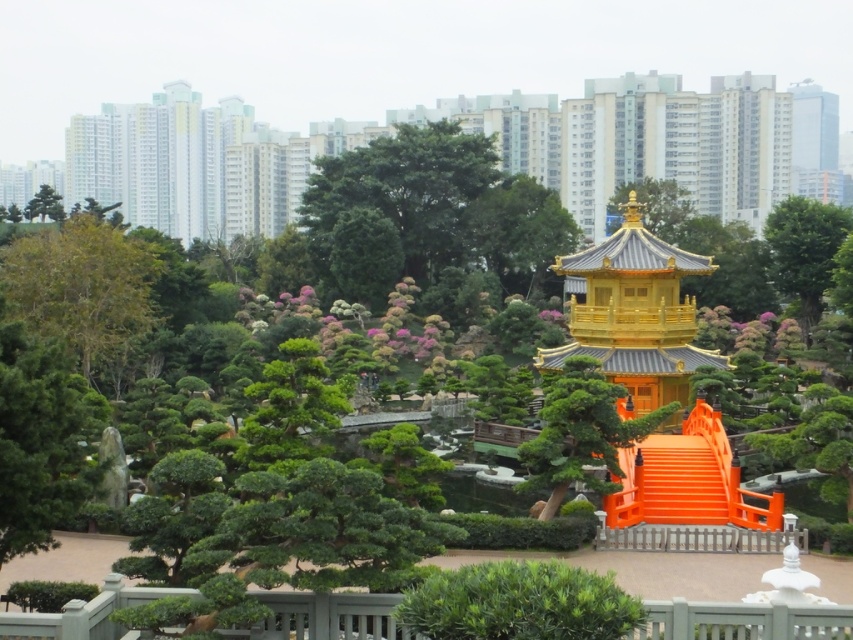
Question: Which point is farther to the camera?

Choices:
 (A) green matte tree at upper left
 (B) green leafy bush at center

Answer: (A)

Question: Can you confirm if green leafy tree at left is positioned to the right of green leafy tree at upper right?

Choices:
 (A) yes
 (B) no

Answer: (B)

Question: Which point is farther to the camera?

Choices:
 (A) green leafy tree at center
 (B) green matte tree at lower left

Answer: (A)

Question: Based on their relative distances, which object is nearer to the green matte tree at center?

Choices:
 (A) golden polished wood gazebo at center
 (B) golden polished wood temple at center
 (C) green matte tree at upper left
 (D) green leafy tree at upper right

Answer: (A)

Question: Observing the image, what is the correct spatial positioning of golden polished wood temple at center in reference to green matte tree at upper left?

Choices:
 (A) right
 (B) left

Answer: (A)

Question: Does golden polished wood gazebo at center have a greater width compared to green matte tree at upper left?

Choices:
 (A) no
 (B) yes

Answer: (A)